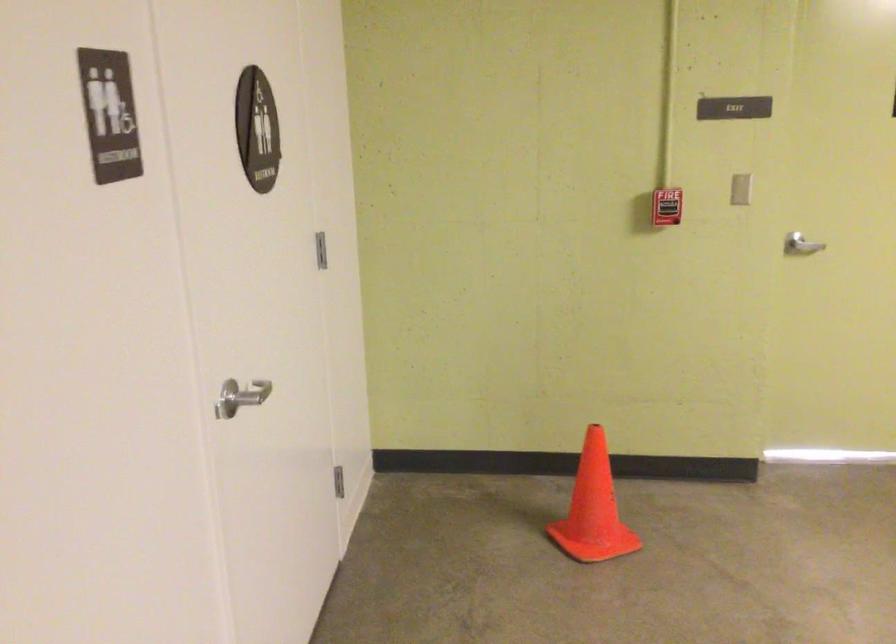
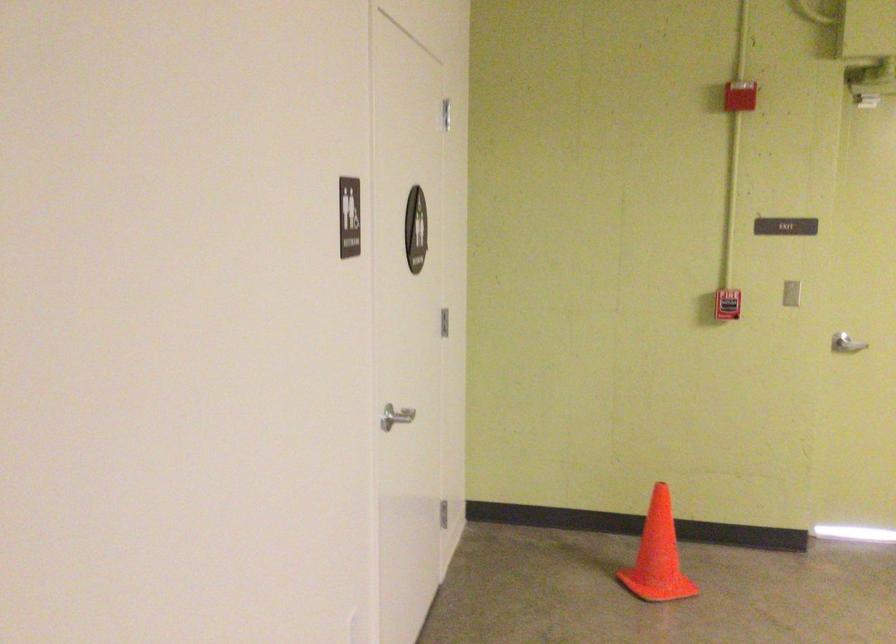
The point at (586, 507) is marked in the first image. Where is the corresponding point in the second image?

(658, 556)